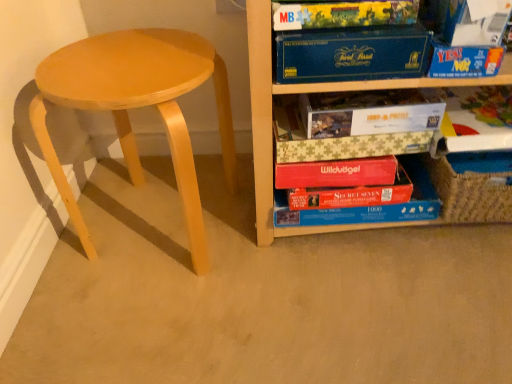
In order to click on vacant space that's between light wood stool at left and wooden puzzle box at right in this screenshot , I will do `click(321, 248)`.